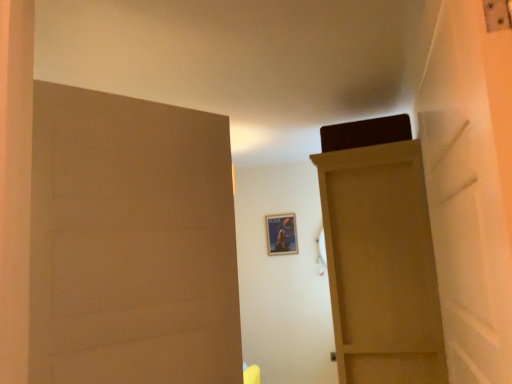
Question: Could matte wood door at left, the second door when ordered from right to left, be considered to be inside metallic poster at center?

Choices:
 (A) no
 (B) yes

Answer: (A)

Question: Can we say metallic poster at center lies outside matte wood door at left, the first door positioned from the front?

Choices:
 (A) yes
 (B) no

Answer: (A)

Question: From the image's perspective, is metallic poster at center below matte wood door at left, the second door when ordered from right to left?

Choices:
 (A) no
 (B) yes

Answer: (B)

Question: Is metallic poster at center aimed at matte wood door at left, the first door positioned from the front?

Choices:
 (A) yes
 (B) no

Answer: (A)

Question: Are metallic poster at center and matte wood door at left, arranged as the 2th door when viewed from the back, beside each other?

Choices:
 (A) no
 (B) yes

Answer: (A)

Question: Is metallic poster at center wider or thinner than matte wood door at left, arranged as the 2th door when viewed from the back?

Choices:
 (A) thin
 (B) wide

Answer: (A)

Question: Considering the relative positions of metallic poster at center and matte wood door at left, the second door when ordered from right to left, in the image provided, is metallic poster at center to the left or to the right of matte wood door at left, the second door when ordered from right to left,?

Choices:
 (A) right
 (B) left

Answer: (A)

Question: Based on their sizes in the image, would you say metallic poster at center is bigger or smaller than matte wood door at left, the second door when ordered from right to left?

Choices:
 (A) small
 (B) big

Answer: (A)

Question: From the image's perspective, is metallic poster at center above or below matte wood door at left, the first door positioned from the front?

Choices:
 (A) above
 (B) below

Answer: (B)

Question: Does point (441, 364) appear closer or farther from the camera than point (290, 251)?

Choices:
 (A) closer
 (B) farther

Answer: (A)

Question: Is matte wood door at upper right, arranged as the 2th door when viewed from the left, wider or thinner than metallic poster at center?

Choices:
 (A) wide
 (B) thin

Answer: (A)

Question: In terms of size, does matte wood door at upper right, placed as the 1th door when sorted from right to left, appear bigger or smaller than metallic poster at center?

Choices:
 (A) big
 (B) small

Answer: (A)

Question: Considering their positions, is matte wood door at upper right, placed as the 1th door when sorted from right to left, located in front of or behind metallic poster at center?

Choices:
 (A) front
 (B) behind

Answer: (A)

Question: From the image's perspective, is matte wood door at upper right, arranged as the 2th door when viewed from the left, above or below matte wood door at left, which appears as the 1th door when viewed from the left?

Choices:
 (A) below
 (B) above

Answer: (A)

Question: Looking at the image, does matte wood door at upper right, placed as the 1th door when sorted from right to left, seem bigger or smaller compared to matte wood door at left, arranged as the 2th door when viewed from the back?

Choices:
 (A) small
 (B) big

Answer: (B)